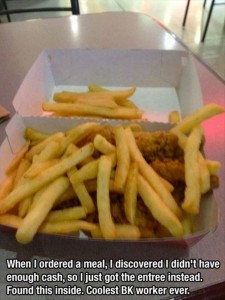
I want to click on corner of table, so click(147, 15).